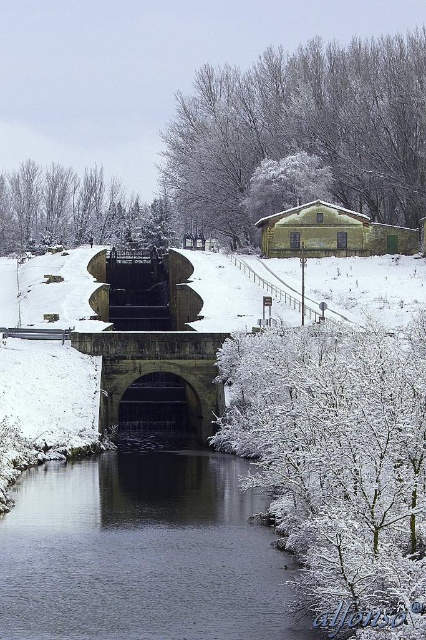
Can you confirm if dark gray water at center is taller than white frosty tree at upper center?

No, dark gray water at center is not taller than white frosty tree at upper center.

Does dark gray water at center lie in front of white frosty tree at upper center?

That is True.

Describe the element at coordinates (141, 554) in the screenshot. I see `dark gray water at center` at that location.

I want to click on dark gray water at center, so click(x=141, y=554).

From the picture: Can you confirm if white frosty tree at upper center is positioned to the right of white snow-covered tree at upper left?

Yes, white frosty tree at upper center is to the right of white snow-covered tree at upper left.

Who is positioned more to the right, white frosty tree at upper center or white snow-covered tree at upper left?

white frosty tree at upper center is more to the right.

Image resolution: width=426 pixels, height=640 pixels. Describe the element at coordinates (305, 129) in the screenshot. I see `white frosty tree at upper center` at that location.

At what (x,y) coordinates should I click in order to perform the action: click on white frosty tree at upper center. Please return your answer as a coordinate pair (x, y). Looking at the image, I should click on (305, 129).

Does white snow-covered tree at upper left appear under stone arch bridge at center?

Incorrect, white snow-covered tree at upper left is not positioned below stone arch bridge at center.

Who is positioned more to the left, white snow-covered tree at upper left or stone arch bridge at center?

white snow-covered tree at upper left is more to the left.

Between point (166, 243) and point (201, 385), which one is positioned in front?

Positioned in front is point (201, 385).

The image size is (426, 640). I want to click on white snow-covered tree at upper left, so click(74, 211).